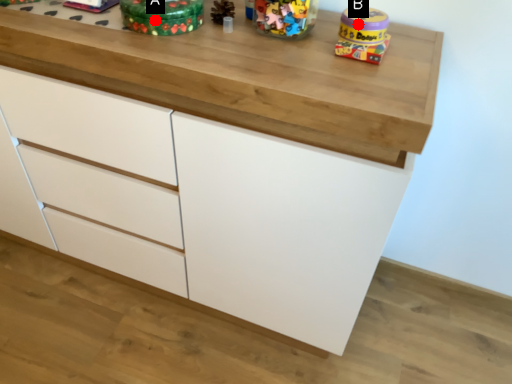
Question: Two points are circled on the image, labeled by A and B beside each circle. Among these points, which one is nearest to the camera?

Choices:
 (A) A is closer
 (B) B is closer

Answer: (B)